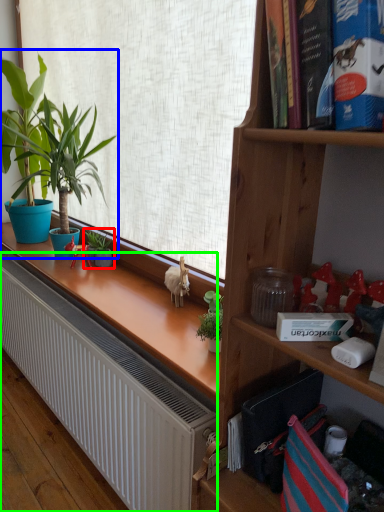
Question: Based on their relative distances, which object is nearer to houseplant (highlighted by a red box)? Choose from houseplant (highlighted by a blue box) and radiator (highlighted by a green box).

Choices:
 (A) houseplant
 (B) radiator

Answer: (A)